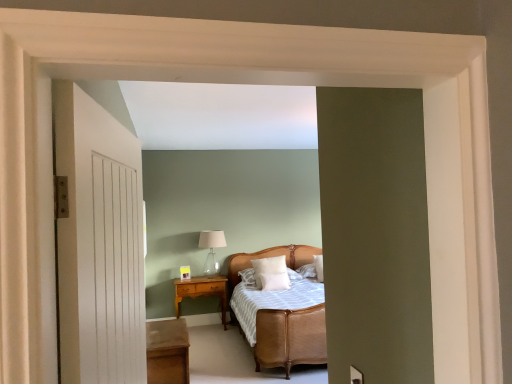
Question: Is wooden table at lower left behind white wooden door at left?

Choices:
 (A) yes
 (B) no

Answer: (A)

Question: From a real-world perspective, is wooden table at lower left physically above white wooden door at left?

Choices:
 (A) yes
 (B) no

Answer: (B)

Question: Is wooden table at lower left at the right side of white wooden door at left?

Choices:
 (A) yes
 (B) no

Answer: (B)

Question: Is white wooden door at left located within wooden table at lower left?

Choices:
 (A) yes
 (B) no

Answer: (B)

Question: Can you confirm if wooden table at lower left is shorter than white wooden door at left?

Choices:
 (A) no
 (B) yes

Answer: (B)

Question: Is wooden table at lower left thinner than white wooden door at left?

Choices:
 (A) yes
 (B) no

Answer: (B)

Question: Does rattan bed at center have a lesser width compared to clear glass table lamp at center?

Choices:
 (A) no
 (B) yes

Answer: (A)

Question: Is rattan bed at center shorter than clear glass table lamp at center?

Choices:
 (A) yes
 (B) no

Answer: (B)

Question: Is clear glass table lamp at center inside rattan bed at center?

Choices:
 (A) yes
 (B) no

Answer: (B)

Question: Considering the relative sizes of rattan bed at center and clear glass table lamp at center in the image provided, is rattan bed at center wider than clear glass table lamp at center?

Choices:
 (A) no
 (B) yes

Answer: (B)

Question: Does rattan bed at center come behind clear glass table lamp at center?

Choices:
 (A) yes
 (B) no

Answer: (B)

Question: Considering the relative positions of rattan bed at center and clear glass table lamp at center in the image provided, is rattan bed at center to the right of clear glass table lamp at center from the viewer's perspective?

Choices:
 (A) yes
 (B) no

Answer: (A)

Question: Can you confirm if wooden nightstand at center is wider than white soft pillow at center, which is the 2th pillow in left-to-right order?

Choices:
 (A) no
 (B) yes

Answer: (B)